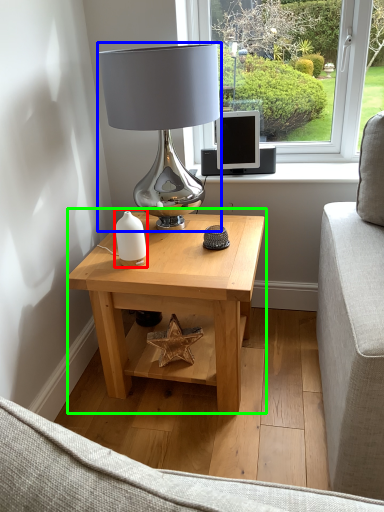
Question: Which is farther away from candle holder (highlighted by a red box)? table lamp (highlighted by a blue box) or table (highlighted by a green box)?

Choices:
 (A) table lamp
 (B) table

Answer: (A)